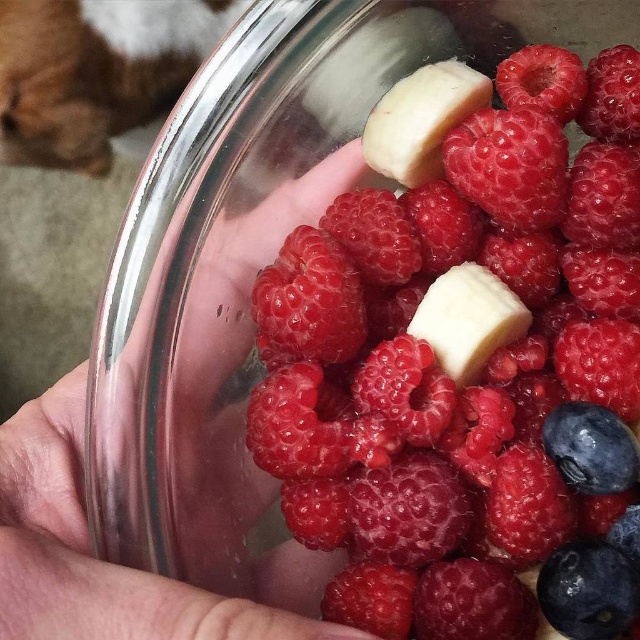
You are a photographer trying to capture a closeup of the glossy red raspberry at center. The camera is set to focus at 10 inches. Will the raspberry be in focus?

The glossy red raspberry at center is 10.47 inches from the camera. Since the focus is set at 10 inches, the distance difference of 0.47 inches may result in slight blurriness unless the depth of field is sufficient to cover this distance. However, without knowing the depth of field, it is uncertain if the raspberry will be perfectly in focus.

You are a fruit seller arranging fruits in a bowl. You want to place a new banana chunk exactly at the same position as the glossy red raspberry at center. What coordinates should you aim for?

The glossy red raspberry at center is located at coordinates (x=470, y=371), so you should aim for those coordinates to place the banana chunk in the same position.